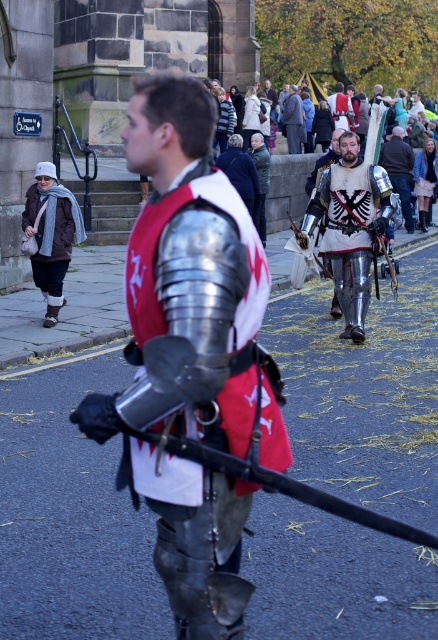
Question: Is shiny silver armor at center smaller than brown leather jacket at left?

Choices:
 (A) yes
 (B) no

Answer: (B)

Question: From the image, what is the correct spatial relationship of silver metallic armor at center in relation to matte gray suit at center?

Choices:
 (A) left
 (B) right

Answer: (B)

Question: Which object appears farthest from the camera in this image?

Choices:
 (A) polished silver armor at center
 (B) matte gray suit at center
 (C) silver metallic armor at center
 (D) shiny silver armor at center

Answer: (B)

Question: Which point appears closest to the camera in this image?

Choices:
 (A) (191, 492)
 (B) (60, 248)

Answer: (A)

Question: Does silver metallic armor at center have a larger size compared to matte gray suit at center?

Choices:
 (A) no
 (B) yes

Answer: (B)

Question: Which object is closer to the camera taking this photo?

Choices:
 (A) brown leather jacket at left
 (B) silver metallic armor at center
 (C) shiny silver armor at center
 (D) matte gray suit at center

Answer: (C)